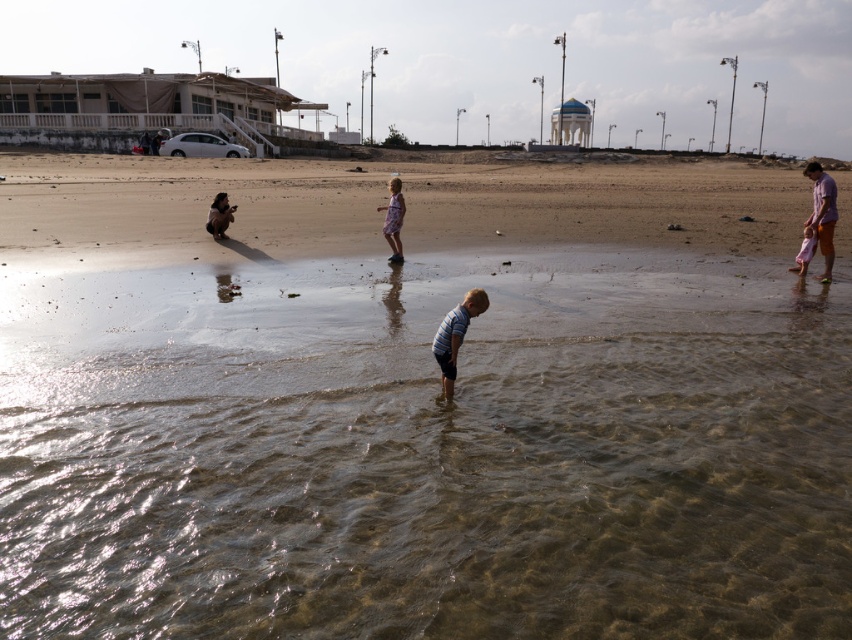
Is striped cotton shirt at center positioned before brown fur dog at center?

Yes, striped cotton shirt at center is closer to the viewer.

Who is more distant from viewer, (447, 342) or (222, 214)?

The point (222, 214) is behind.

Image resolution: width=852 pixels, height=640 pixels. Describe the element at coordinates (455, 336) in the screenshot. I see `striped cotton shirt at center` at that location.

Find the location of a particular element. striped cotton shirt at center is located at coordinates (455, 336).

In the scene shown: Can you confirm if brown sandy beach at center is shorter than floral dress at center?

Incorrect, brown sandy beach at center's height does not fall short of floral dress at center's.

Does brown sandy beach at center appear under floral dress at center?

No, brown sandy beach at center is not below floral dress at center.

In order to click on brown sandy beach at center in this screenshot , I will do tap(386, 202).

You are a GUI agent. You are given a task and a screenshot of the screen. Output one action in this format:
    pyautogui.click(x=<x>, y=<y>)
    Task: Click on the brown sandy beach at center
    The height and width of the screenshot is (640, 852).
    Given the screenshot: What is the action you would take?
    pyautogui.click(x=386, y=202)

Does clear water at lower center appear on the right side of striped cotton shirt at center?

In fact, clear water at lower center is to the left of striped cotton shirt at center.

Based on the photo, does clear water at lower center have a smaller size compared to striped cotton shirt at center?

Indeed, clear water at lower center has a smaller size compared to striped cotton shirt at center.

Locate an element on the screen. clear water at lower center is located at coordinates (432, 490).

What are the coordinates of `clear water at lower center` in the screenshot? It's located at (432, 490).